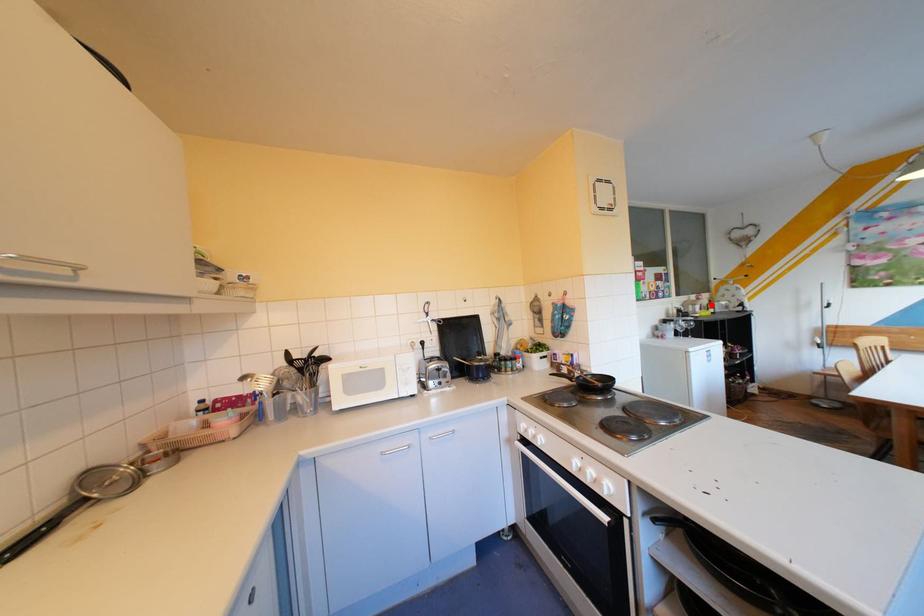
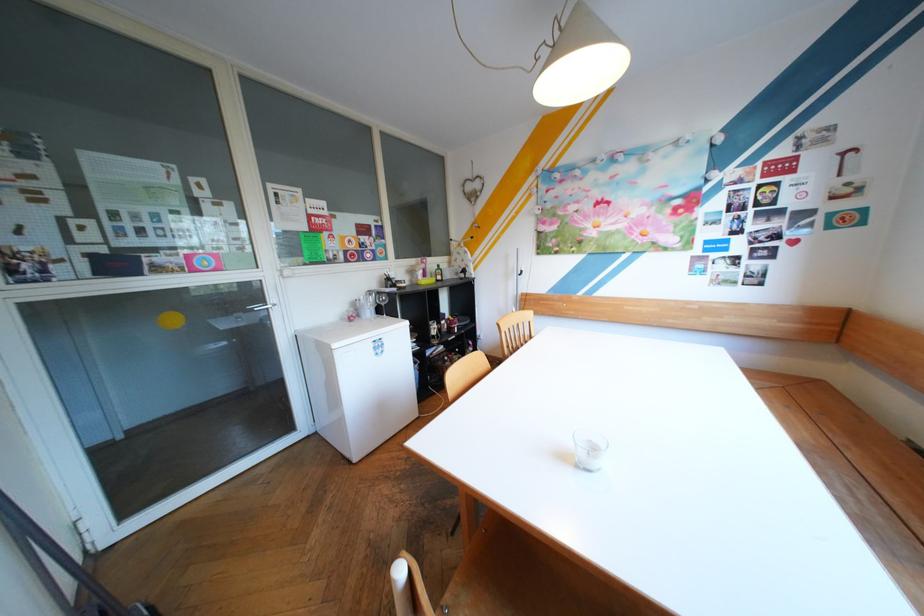
In the second image, find the point that corresponds to the highlighted location in the first image.

(434, 270)